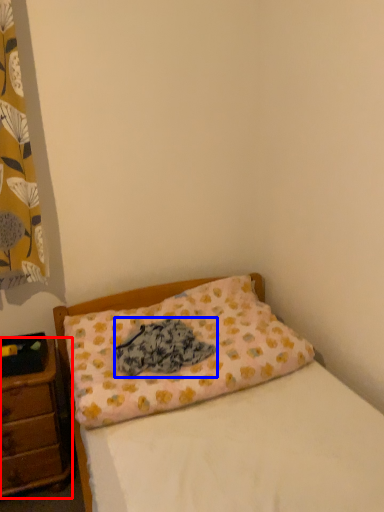
Question: Which object appears closest to the camera in this image, nightstand (highlighted by a red box) or material (highlighted by a blue box)?

Choices:
 (A) nightstand
 (B) material

Answer: (B)